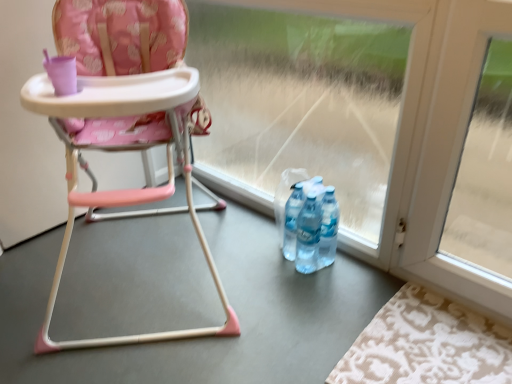
Find the location of a particular element. Image resolution: width=512 pixels, height=384 pixels. free space that is in between matte plastic highchair at center and transparent glass door at center is located at coordinates (252, 254).